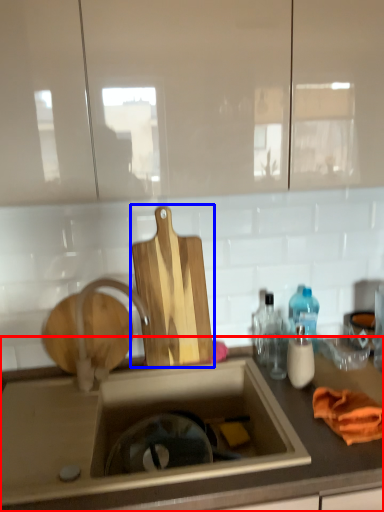
Question: Among these objects, which one is nearest to the camera, countertop (highlighted by a red box) or cutting board (highlighted by a blue box)?

Choices:
 (A) countertop
 (B) cutting board

Answer: (A)